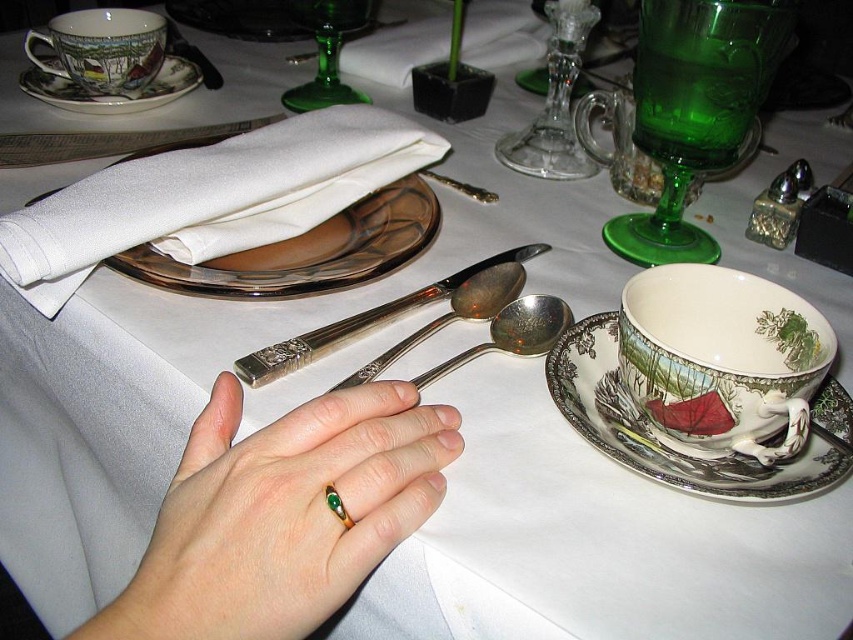
Question: Is porcelain cup at right above white porcelain plate at upper center?

Choices:
 (A) no
 (B) yes

Answer: (A)

Question: Is decorative porcelain saucer at lower right below matte porcelain teacup at upper left?

Choices:
 (A) yes
 (B) no

Answer: (A)

Question: Which of these objects is positioned closest to the silver/glossy spoon at center?

Choices:
 (A) white porcelain plate at upper center
 (B) polished silver spoon at center
 (C) gold/green ring at center
 (D) porcelain saucer at upper left

Answer: (B)

Question: Which object is the farthest from the white porcelain plate at upper center?

Choices:
 (A) decorative porcelain saucer at lower right
 (B) polished silver spoon at center
 (C) gold/green ring at center

Answer: (A)

Question: Which of the following is the closest to the observer?

Choices:
 (A) porcelain cup at right
 (B) matte porcelain teacup at upper left

Answer: (A)

Question: Is white porcelain plate at upper center closer to camera compared to porcelain saucer at upper left?

Choices:
 (A) no
 (B) yes

Answer: (B)